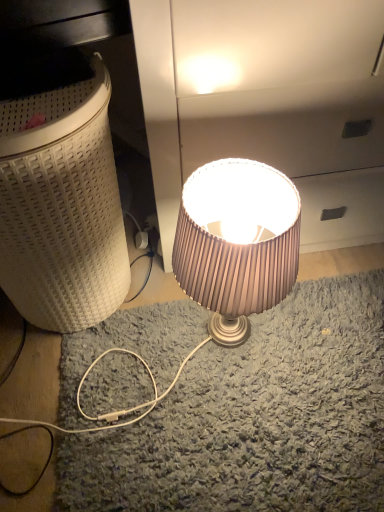
The image size is (384, 512). I want to click on satin beige lampshade at center, so click(x=237, y=243).

The width and height of the screenshot is (384, 512). What do you see at coordinates (237, 243) in the screenshot?
I see `satin beige lampshade at center` at bounding box center [237, 243].

Measure the distance between point (288,220) and camera.

They are 30.35 inches apart.

The image size is (384, 512). Find the location of `white woven laundry basket at left`. white woven laundry basket at left is located at coordinates (62, 208).

Describe the element at coordinates (62, 208) in the screenshot. The image size is (384, 512). I see `white woven laundry basket at left` at that location.

Where is `satin beige lampshade at center`? satin beige lampshade at center is located at coordinates (237, 243).

Can you confirm if white woven laundry basket at left is positioned to the right of satin beige lampshade at center?

No.

Based on the photo, does white woven laundry basket at left lie behind satin beige lampshade at center?

No, it is in front of satin beige lampshade at center.

Looking at this image, which point is more forward, (x=22, y=295) or (x=207, y=238)?

The point (x=207, y=238) is in front.

From the image's perspective, which is below, white woven laundry basket at left or satin beige lampshade at center?

From the image's view, satin beige lampshade at center is below.

From a real-world perspective, between white woven laundry basket at left and satin beige lampshade at center, who is vertically higher?

white woven laundry basket at left is physically above.

Can you confirm if white woven laundry basket at left is wider than satin beige lampshade at center?

Correct, the width of white woven laundry basket at left exceeds that of satin beige lampshade at center.

Looking at this image, is white woven laundry basket at left taller or shorter than satin beige lampshade at center?

white woven laundry basket at left is taller than satin beige lampshade at center.

Does white woven laundry basket at left have a larger size compared to satin beige lampshade at center?

Indeed, white woven laundry basket at left has a larger size compared to satin beige lampshade at center.

Consider the image. Is white woven laundry basket at left not inside satin beige lampshade at center?

Yes.

Does white woven laundry basket at left touch satin beige lampshade at center?

No, white woven laundry basket at left is not making contact with satin beige lampshade at center.

Could you tell me if white woven laundry basket at left is facing satin beige lampshade at center?

No, white woven laundry basket at left does not turn towards satin beige lampshade at center.

From the picture: What's the angular difference between white woven laundry basket at left and satin beige lampshade at center's facing directions?

0.742 degrees.

The image size is (384, 512). I want to click on lamp below the white woven laundry basket at left (from the image's perspective), so point(237,243).

Considering the positions of objects satin beige lampshade at center and white woven laundry basket at left in the image provided, who is more to the right, satin beige lampshade at center or white woven laundry basket at left?

Positioned to the right is satin beige lampshade at center.

Considering their positions, is satin beige lampshade at center located in front of or behind white woven laundry basket at left?

In the image, satin beige lampshade at center appears behind white woven laundry basket at left.

Which is closer to the camera, (284,278) or (3,129)?

Point (284,278).

From the image's perspective, between satin beige lampshade at center and white woven laundry basket at left, who is located below?

satin beige lampshade at center.

From a real-world perspective, who is located lower, satin beige lampshade at center or white woven laundry basket at left?

From a 3D spatial view, satin beige lampshade at center is below.

Considering the relative sizes of satin beige lampshade at center and white woven laundry basket at left in the image provided, is satin beige lampshade at center wider than white woven laundry basket at left?

No, satin beige lampshade at center is not wider than white woven laundry basket at left.

Who is shorter, satin beige lampshade at center or white woven laundry basket at left?

Standing shorter between the two is satin beige lampshade at center.

Considering the sizes of satin beige lampshade at center and white woven laundry basket at left in the image, is satin beige lampshade at center bigger or smaller than white woven laundry basket at left?

Clearly, satin beige lampshade at center is smaller in size than white woven laundry basket at left.

Is satin beige lampshade at center not inside white woven laundry basket at left?

That's correct, satin beige lampshade at center is outside of white woven laundry basket at left.

In the scene shown: Is satin beige lampshade at center in contact with white woven laundry basket at left?

satin beige lampshade at center and white woven laundry basket at left are clearly separated.

Could you tell me if satin beige lampshade at center is facing white woven laundry basket at left?

No, satin beige lampshade at center is not turned towards white woven laundry basket at left.

This screenshot has width=384, height=512. Identify the location of lamp that is below the white woven laundry basket at left (from the image's perspective). (237, 243).

Find the location of a particular element. This screenshot has height=512, width=384. lamp on the right of the white woven laundry basket at left is located at coordinates (237, 243).

Locate an element on the screen. The image size is (384, 512). lamp beneath the white woven laundry basket at left (from a real-world perspective) is located at coordinates (237, 243).